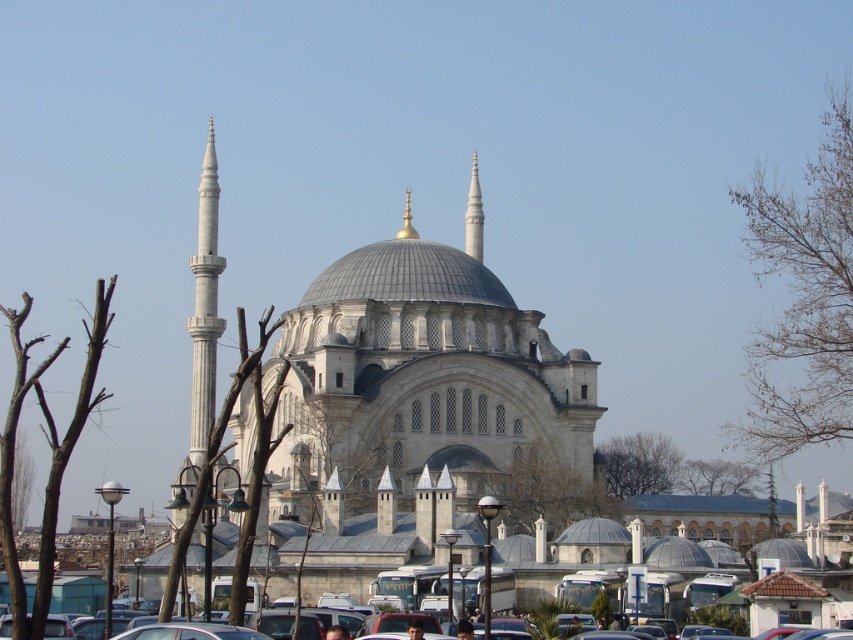
Question: Can you confirm if brown/dry branches at left is positioned above green leafy tree at center?

Choices:
 (A) yes
 (B) no

Answer: (A)

Question: Which point is farther to the camera?

Choices:
 (A) (511, 628)
 (B) (28, 474)
 (C) (851, 232)
 (D) (550, 467)

Answer: (B)

Question: Which point is farther to the camera?

Choices:
 (A) matte black car at center
 (B) brown/dry branches at left

Answer: (B)

Question: Does brown/dry branches at left appear on the left side of green leafy tree at center?

Choices:
 (A) no
 (B) yes

Answer: (B)

Question: Does green leafy tree at upper center appear under brown bark tree at left?

Choices:
 (A) no
 (B) yes

Answer: (A)

Question: Among these points, which one is nearest to the camera?

Choices:
 (A) (102, 636)
 (B) (21, 392)
 (C) (738, 472)

Answer: (B)